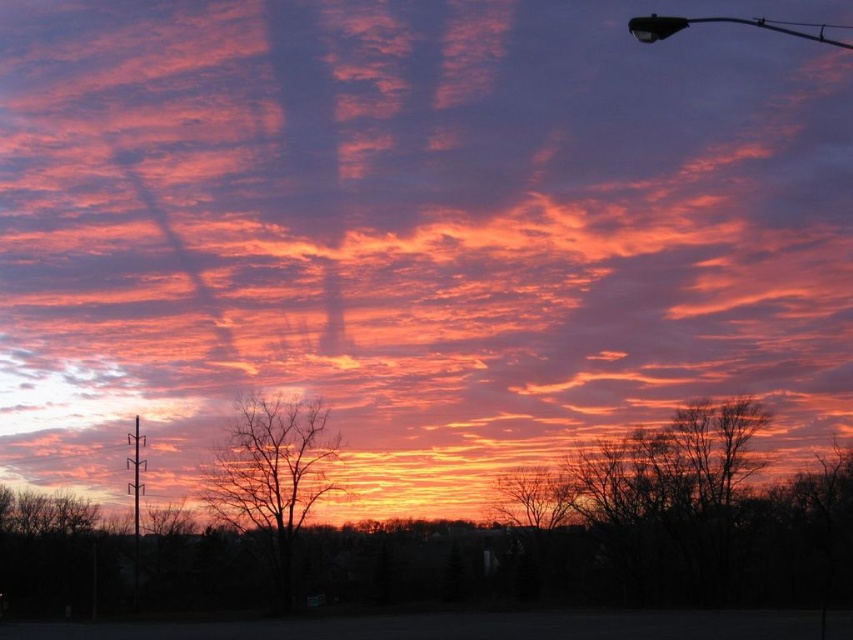
You are a painter standing at the center of the scene, wanting to paint both the silhouette bare tree at center and the metallic gray pole at left. Given that your painting canvas is 2 meters wide, can you fit both objects on the canvas without moving your position?

The silhouette bare tree at center and metallic gray pole at left are 16.72 meters apart from each other. Since the canvas is only 2 meters wide, the distance between them is too large to fit both on the canvas without moving your position.

You are an astronomer analyzing this sunset image. You need to determine the exact coordinates of the metallic pole at upper right in the image. What are its coordinates?

The metallic pole at upper right is located at coordinates point [722,20].

You are an artist trying to sketch the sunset scene. You want to place the silhouette bare tree at center in your drawing. According to the image, what are the coordinates where you should position it?

The silhouette bare tree at center should be positioned at coordinates 0.744 on the x axis and 0.319 on the y axis as per the image.